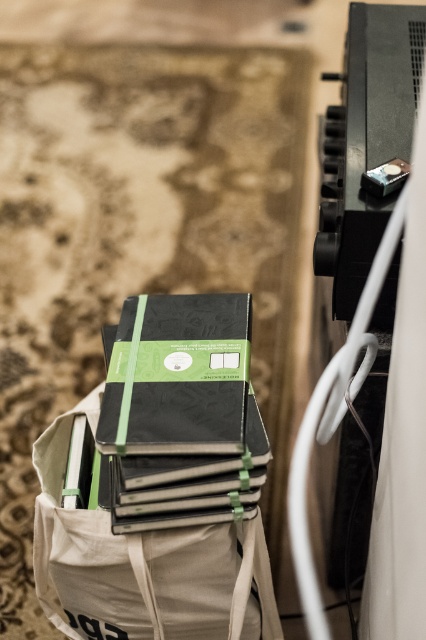
Based on the photo, can you confirm if canvas tote bag at center is positioned below matte black notebook at center?

Indeed, canvas tote bag at center is positioned under matte black notebook at center.

Which is behind, point (224, 545) or point (134, 353)?

The point (134, 353) is more distant.

Where is `canvas tote bag at center`? canvas tote bag at center is located at coordinates (143, 564).